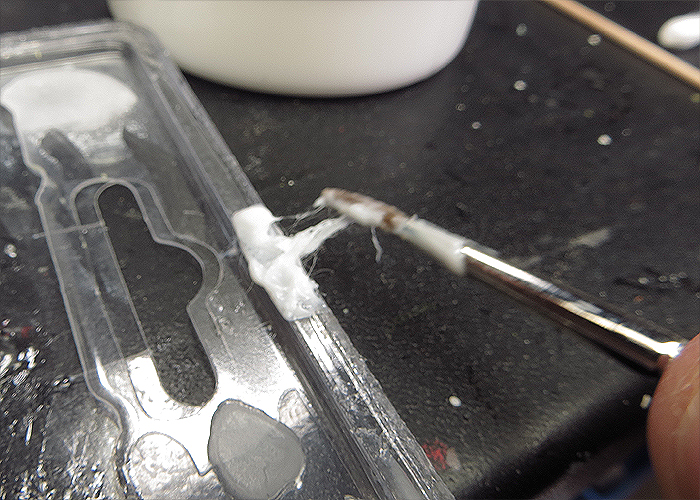
At what (x,y) coordinates should I click in order to perform the action: click on black table. Please return your answer as a coordinate pair (x, y). This screenshot has width=700, height=500. Looking at the image, I should click on (488, 394).